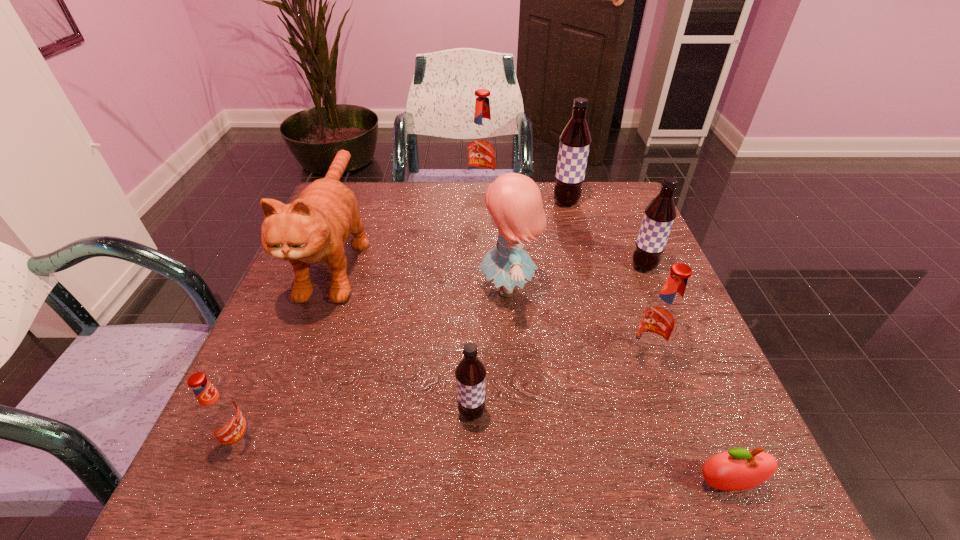
Locate an element on the screen. This screenshot has height=540, width=960. the nearest root beer is located at coordinates (220, 414).

At what (x,y) coordinates should I click in order to perform the action: click on the leftmost red root beer. Please return your answer as a coordinate pair (x, y). Looking at the image, I should click on (220, 414).

Where is `the leftmost brown root beer`? the leftmost brown root beer is located at coordinates (470, 373).

Identify the location of the seventh farthest object. This screenshot has width=960, height=540. (470, 373).

At what (x,y) coordinates should I click in order to perform the action: click on the shortest object. Please return your answer as a coordinate pair (x, y). Looking at the image, I should click on (737, 469).

I want to click on apple, so click(737, 469).

Locate an element on the screen. The height and width of the screenshot is (540, 960). vacant space positioned 0.250m on the front of the second red root beer from right to left is located at coordinates (483, 252).

Locate an element on the screen. The image size is (960, 540). free region located on the right of the biggest brown root beer is located at coordinates (605, 202).

The width and height of the screenshot is (960, 540). Identify the location of vacant space located on the front-facing side of the blue doll. (452, 288).

You are a GUI agent. You are given a task and a screenshot of the screen. Output one action in this format:
    pyautogui.click(x=<x>, y=<y>)
    Task: Click on the free space located on the front-facing side of the blue doll
    The height and width of the screenshot is (540, 960).
    Given the screenshot: What is the action you would take?
    pyautogui.click(x=408, y=288)